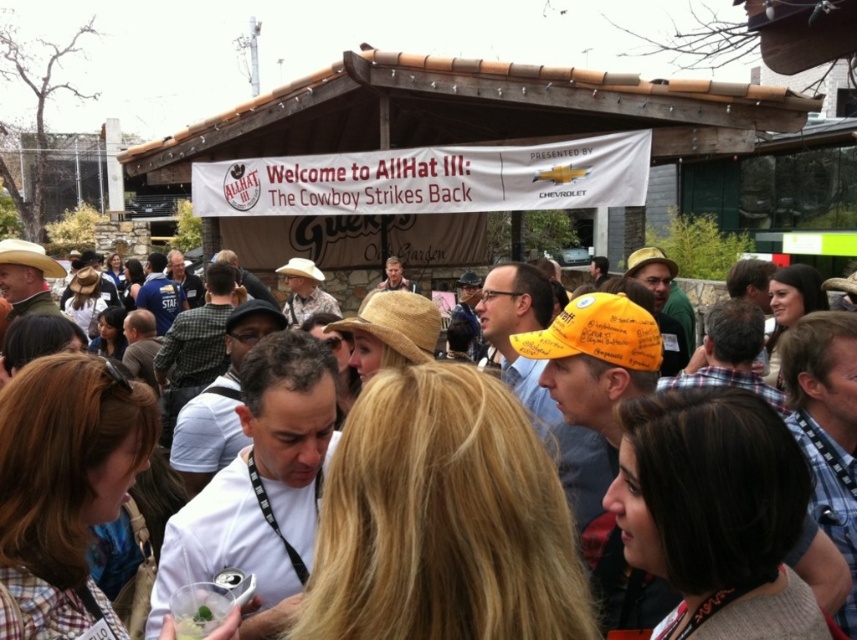
You are at a cowboy themed event and want to wear a hat that is thinner than the other. Which hat should you choose between the natural straw cowboy hat at center and the brown straw hat at center?

The natural straw cowboy hat at center is thinner than the brown straw hat at center, so you should choose the natural straw cowboy hat at center.

You are a photographer at the event and need to capture a clear shot of both the natural straw cowboy hat at center and the brown straw hat at center. Since you want to highlight their height difference, which hat should you position closer to the camera to make it appear taller?

To emphasize the height difference between the natural straw cowboy hat at center and the brown straw hat at center, position the natural straw cowboy hat at center closer to the camera. Since it is shorter than the brown straw hat at center, this perspective will make the shorter hat appear taller relative to the taller one when viewed from a closer angle.

You are a photographer standing at the camera position. You want to take a closeup shot of the natural straw cowboy hat at center. Given that your camera has a maximum zoom range of 30 meters, can you capture the hat clearly?

The natural straw cowboy hat at center is 32.80 meters away from the camera. Since the maximum zoom range is 30 meters, the camera cannot capture the hat clearly at this distance.